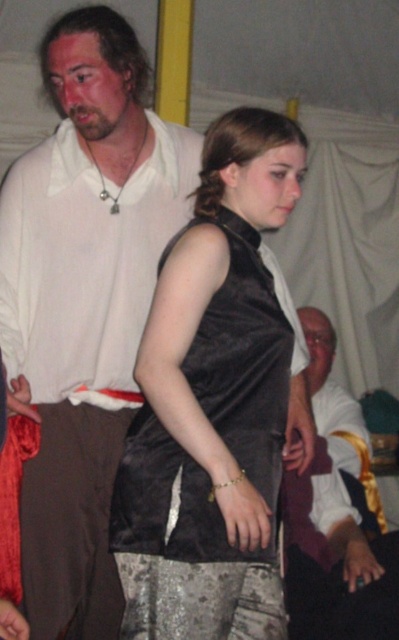
Who is positioned more to the right, matte white shirt at upper left or silky white shirt at center?

From the viewer's perspective, silky white shirt at center appears more on the right side.

Between matte white shirt at upper left and silky white shirt at center, which one is positioned lower?

Positioned lower is silky white shirt at center.

Does point (23, 608) lie behind point (359, 538)?

That is False.

The height and width of the screenshot is (640, 399). I want to click on matte white shirt at upper left, so click(x=82, y=308).

Which is behind, point (122, 419) or point (158, 580)?

The point (122, 419) is behind.

Is matte white shirt at upper left to the left of satin black vest at center from the viewer's perspective?

Indeed, matte white shirt at upper left is positioned on the left side of satin black vest at center.

Locate an element on the screen. Image resolution: width=399 pixels, height=640 pixels. matte white shirt at upper left is located at coordinates (82, 308).

Is satin black vest at center bigger than silky white shirt at center?

No.

What do you see at coordinates (215, 404) in the screenshot? I see `satin black vest at center` at bounding box center [215, 404].

Between point (163, 579) and point (290, 508), which one is positioned behind?

Point (290, 508)

The width and height of the screenshot is (399, 640). I want to click on satin black vest at center, so click(x=215, y=404).